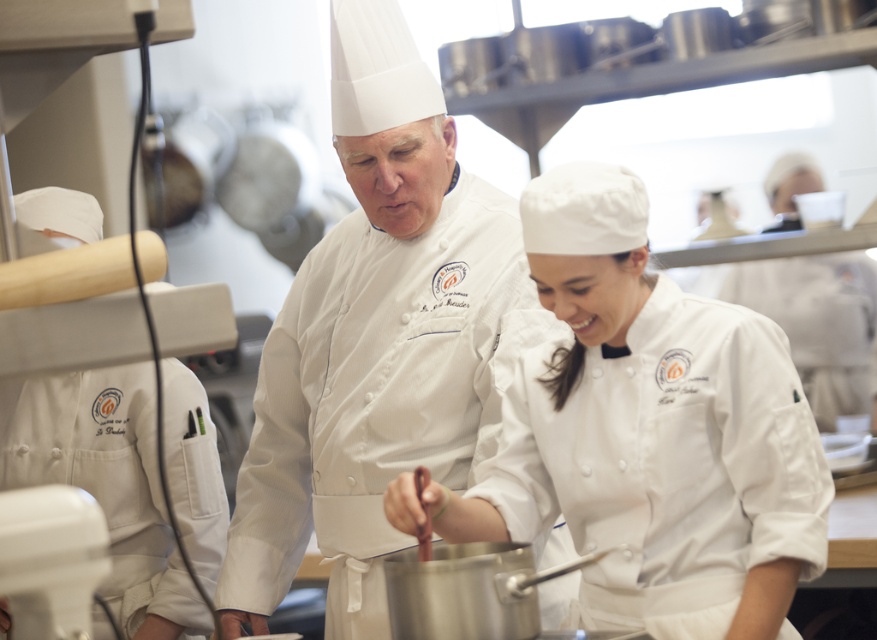
You are a chef in a professional kitchen and need to quickly grab an apron from either the white matte chef coat at center or the white matte uniform at center. Which one is closer to you?

The white matte chef coat at center is closer to you since the distance between them is 15.57 inches, so whichever is closer would depend on your position. However, the description only provides the distance between them, not their relation to you. Without additional information about your position relative to both, it is impossible to determine which is closer.